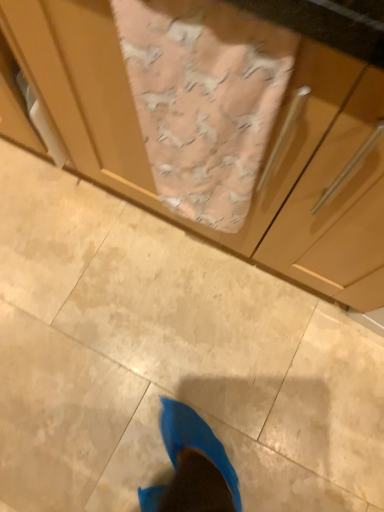
Question: From the image's perspective, is pink fabric at center positioned above or below matte wood cabinet at center?

Choices:
 (A) above
 (B) below

Answer: (B)

Question: In terms of size, does pink fabric at center appear bigger or smaller than matte wood cabinet at center?

Choices:
 (A) big
 (B) small

Answer: (B)

Question: Considering the positions of point (258, 32) and point (117, 53), is point (258, 32) closer or farther from the camera than point (117, 53)?

Choices:
 (A) farther
 (B) closer

Answer: (B)

Question: From a real-world perspective, is matte wood cabinet at center positioned above or below pink fabric at center?

Choices:
 (A) below
 (B) above

Answer: (A)

Question: From the image's perspective, is matte wood cabinet at center located above or below pink fabric at center?

Choices:
 (A) below
 (B) above

Answer: (B)

Question: Would you say matte wood cabinet at center is to the left or to the right of pink fabric at center in the picture?

Choices:
 (A) left
 (B) right

Answer: (A)

Question: Is point (18, 19) closer or farther from the camera than point (241, 190)?

Choices:
 (A) farther
 (B) closer

Answer: (B)